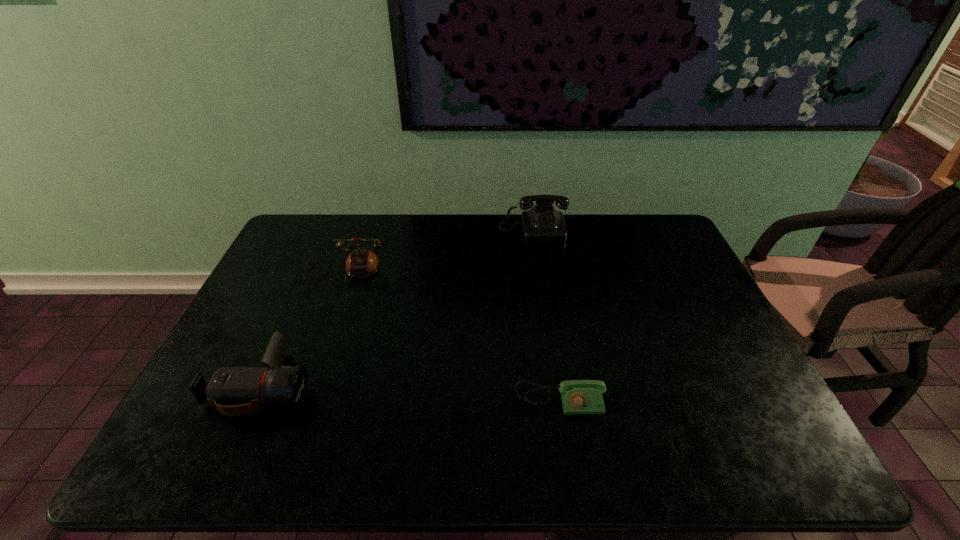
Identify the location of the farthest object. The image size is (960, 540). (542, 223).

Find the location of a particular element. The width and height of the screenshot is (960, 540). the leftmost telephone is located at coordinates (361, 262).

You are a GUI agent. You are given a task and a screenshot of the screen. Output one action in this format:
    pyautogui.click(x=<x>, y=<y>)
    Task: Click on the second farthest object
    The image size is (960, 540).
    Given the screenshot: What is the action you would take?
    pyautogui.click(x=361, y=262)

Where is `camcorder`? This screenshot has height=540, width=960. camcorder is located at coordinates (235, 391).

I want to click on the shortest object, so click(x=579, y=397).

At what (x,y) coordinates should I click in order to perform the action: click on the nearest telephone. Please return your answer as a coordinate pair (x, y). Looking at the image, I should click on (579, 397).

Where is `free spot located 0.190m on the dial of the farthest telephone`? free spot located 0.190m on the dial of the farthest telephone is located at coordinates point(541,279).

The image size is (960, 540). What are the coordinates of `free location located 0.400m on the rotary dial of the second farthest telephone` in the screenshot? It's located at (294, 398).

Where is `free space located on the lens of the camcorder`? This screenshot has height=540, width=960. free space located on the lens of the camcorder is located at coordinates (350, 385).

Where is `free space located 0.120m on the dial of the shortest object`? The height and width of the screenshot is (540, 960). free space located 0.120m on the dial of the shortest object is located at coordinates (570, 467).